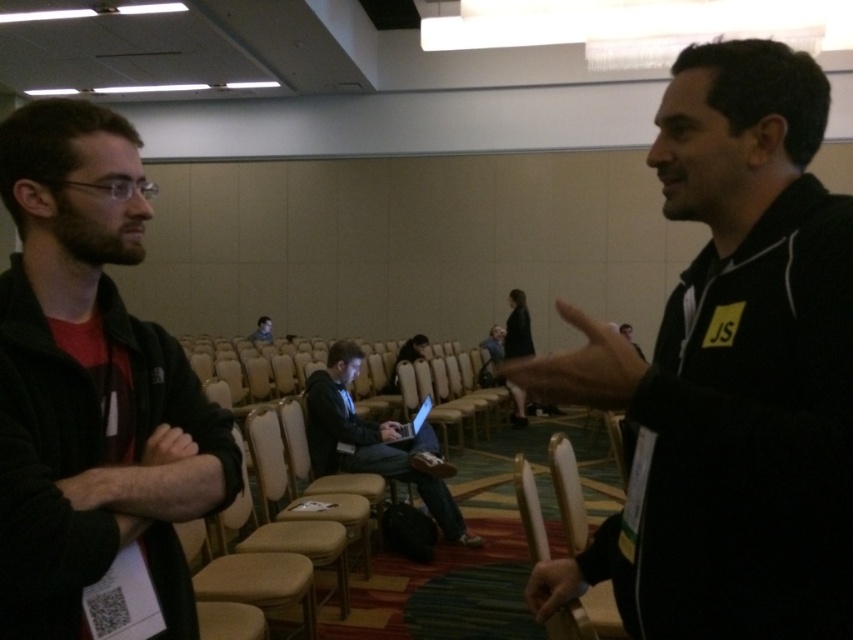
Based on the photo, can you confirm if dark gray fabric jacket at center is bigger than silver metallic laptop at center?

Yes, dark gray fabric jacket at center is bigger than silver metallic laptop at center.

Can you confirm if dark gray fabric jacket at center is positioned to the left of silver metallic laptop at center?

Indeed, dark gray fabric jacket at center is positioned on the left side of silver metallic laptop at center.

Is point (328, 401) closer to camera compared to point (405, 436)?

Yes, point (328, 401) is closer to viewer.

You are a GUI agent. You are given a task and a screenshot of the screen. Output one action in this format:
    pyautogui.click(x=<x>, y=<y>)
    Task: Click on the dark gray fabric jacket at center
    The image size is (853, 640).
    Given the screenshot: What is the action you would take?
    pyautogui.click(x=372, y=442)

Can you confirm if dark green jacket at left is shorter than dark gray fabric jacket at center?

Yes.

Between point (122, 493) and point (453, 531), which one is positioned behind?

Positioned behind is point (453, 531).

Is point (71, 314) in front of point (399, 433)?

That is True.

This screenshot has width=853, height=640. I want to click on dark green jacket at left, so point(91,392).

How distant is black matte jacket at right from light brown leather chair at center?

black matte jacket at right and light brown leather chair at center are 30.55 feet apart from each other.

Can you confirm if black matte jacket at right is positioned to the right of light brown leather chair at center?

Correct, you'll find black matte jacket at right to the right of light brown leather chair at center.

Is point (721, 637) more distant than point (264, 336)?

No.

The image size is (853, 640). What are the coordinates of `black matte jacket at right` in the screenshot? It's located at (729, 374).